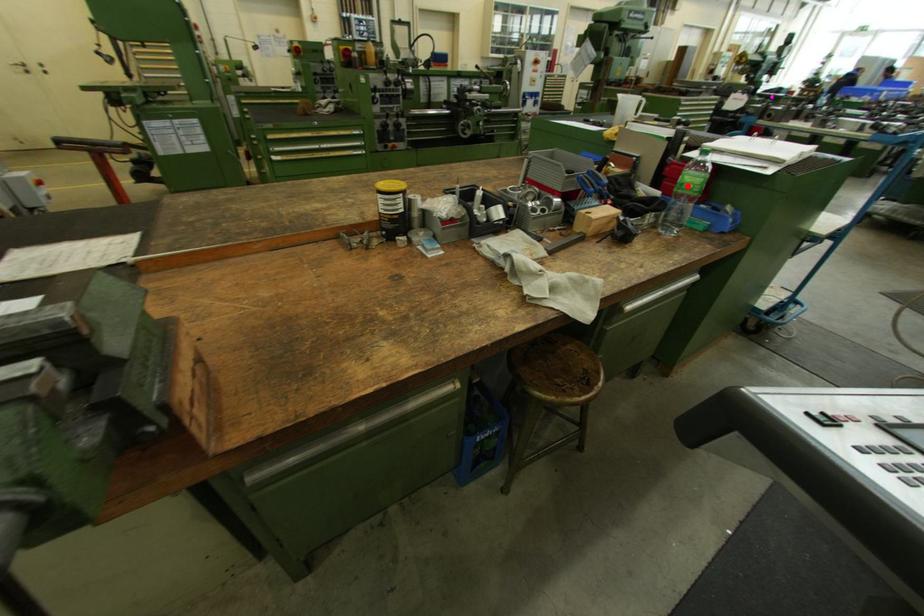
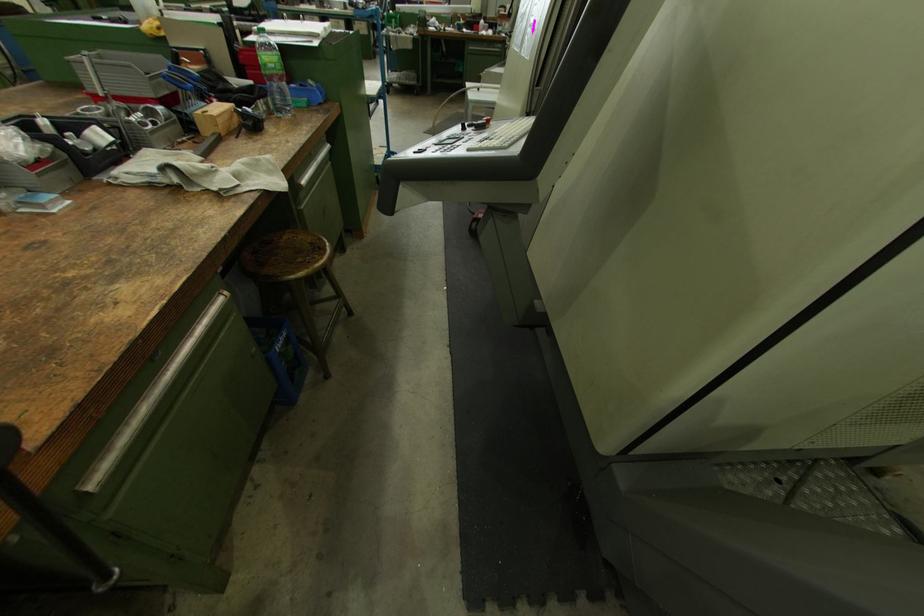
In the second image, find the point that corresponds to the highlighted location in the first image.

(271, 66)